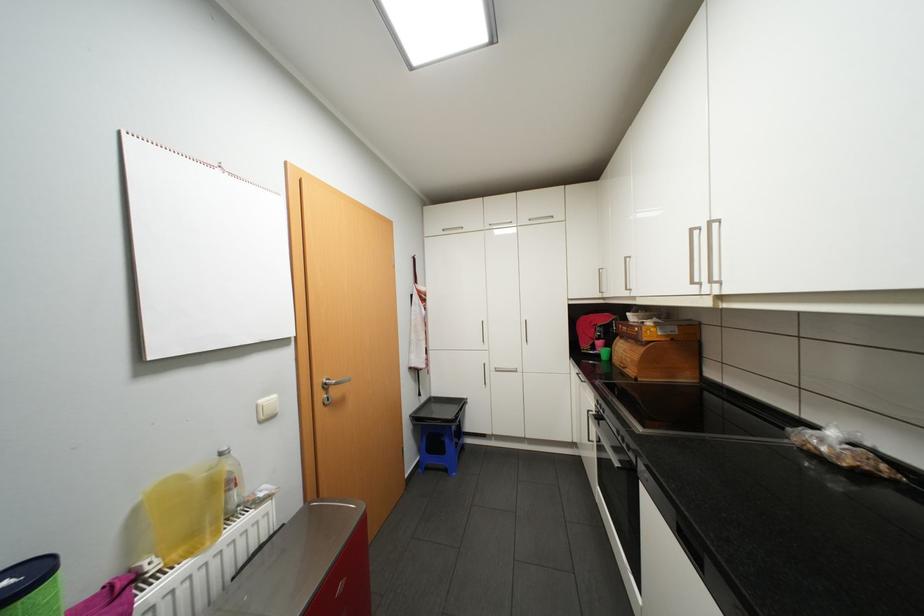
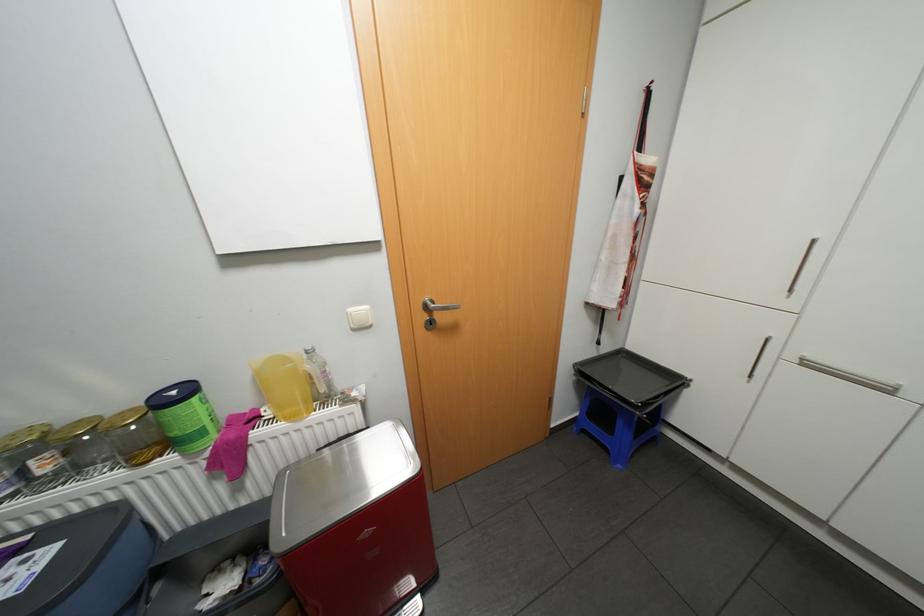
The point at [468,402] is marked in the first image. Where is the corresponding point in the second image?

(684, 379)